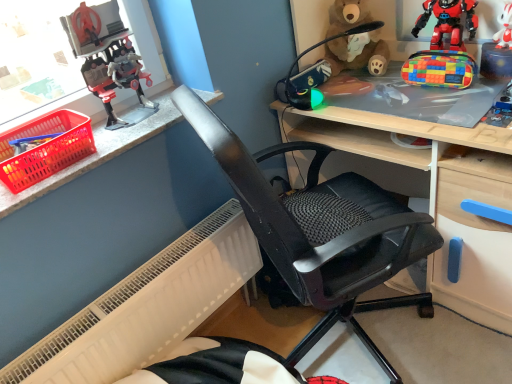
Question: Can you confirm if multicolored fabric pencil case at upper right, which appears as the 3th toy when viewed from the right, is positioned to the left of white plastic radiator at lower left?

Choices:
 (A) yes
 (B) no

Answer: (B)

Question: Is multicolored fabric pencil case at upper right, which is the 3th toy from left to right, not close to white plastic radiator at lower left?

Choices:
 (A) yes
 (B) no

Answer: (A)

Question: Is multicolored fabric pencil case at upper right, which appears as the 3th toy when viewed from the right, positioned before white plastic radiator at lower left?

Choices:
 (A) yes
 (B) no

Answer: (B)

Question: Can you confirm if multicolored fabric pencil case at upper right, which appears as the 3th toy when viewed from the right, is shorter than white plastic radiator at lower left?

Choices:
 (A) no
 (B) yes

Answer: (B)

Question: Is white plastic radiator at lower left a part of multicolored fabric pencil case at upper right, which appears as the 3th toy when viewed from the right?

Choices:
 (A) no
 (B) yes

Answer: (A)

Question: Is multicolored fabric pencil case at upper right, which appears as the 3th toy when viewed from the right, positioned behind white plastic radiator at lower left?

Choices:
 (A) yes
 (B) no

Answer: (A)

Question: Does white plastic radiator at lower left have a lesser height compared to wooden desk at center?

Choices:
 (A) no
 (B) yes

Answer: (B)

Question: From a real-world perspective, is white plastic radiator at lower left positioned under wooden desk at center based on gravity?

Choices:
 (A) no
 (B) yes

Answer: (B)

Question: Does white plastic radiator at lower left have a larger size compared to wooden desk at center?

Choices:
 (A) yes
 (B) no

Answer: (B)

Question: Could you tell me if white plastic radiator at lower left is facing wooden desk at center?

Choices:
 (A) yes
 (B) no

Answer: (B)

Question: Is white plastic radiator at lower left in front of wooden desk at center?

Choices:
 (A) no
 (B) yes

Answer: (A)

Question: From the image's perspective, is white plastic radiator at lower left under wooden desk at center?

Choices:
 (A) no
 (B) yes

Answer: (B)

Question: From a real-world perspective, does black mesh office chair at center sit lower than brown plush bear at upper center?

Choices:
 (A) no
 (B) yes

Answer: (B)